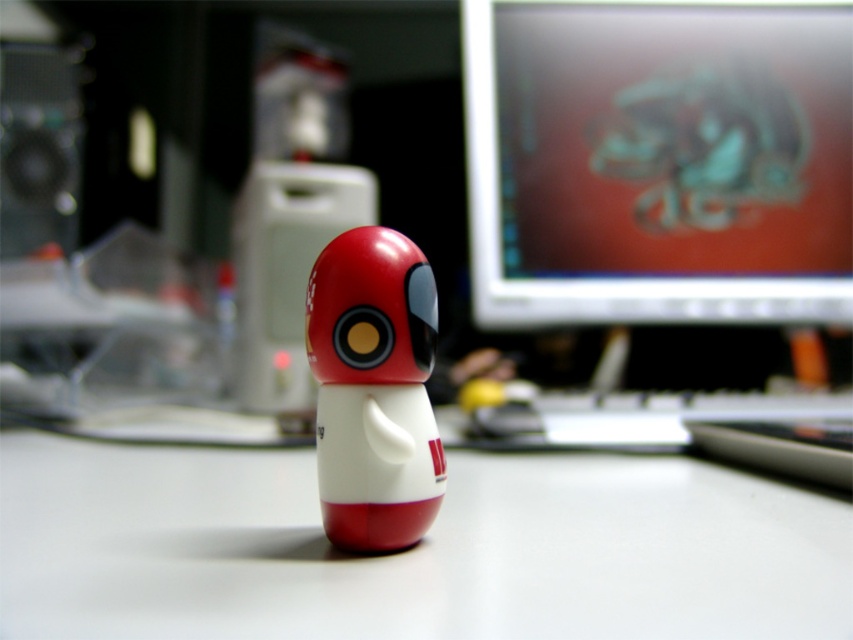
You are standing in front of the workspace shown in the image. There are two points marked on the desk. The first point is at coordinates point [579,528] and the second point is at point [675,186]. Which point is closer to you?

Point [579,528] is closer to the viewer than point [675,186].

You are taking a photo of the figurine and need to adjust your camera focus. There are two points in the image labeled as point (469, 140) and point (410, 358). Which point should you focus on to ensure the figurine is sharp?

You should focus on point (469, 140) because it is closer to the camera than point (410, 358), ensuring the figurine appears sharp in the photo.

You are an office worker who needs to move a cable from the matte plastic monitor at upper right to the matte plastic toy at center. The cable you have is 1 meter long. Will the cable be long enough to reach between the two objects?

The matte plastic monitor at upper right and the matte plastic toy at center are 1.18 meters apart. Since the cable is only 1 meter long, it will not be long enough to reach between the two objects.